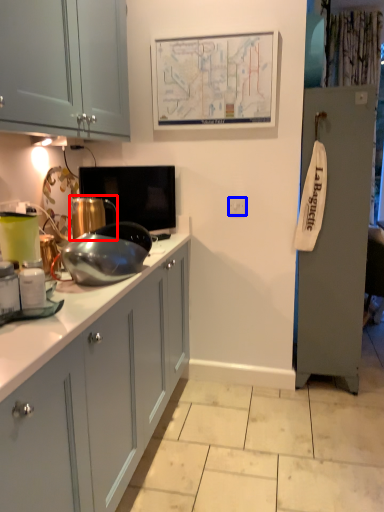
Question: Among these objects, which one is farthest to the camera, appliance (highlighted by a red box) or electric outlet (highlighted by a blue box)?

Choices:
 (A) appliance
 (B) electric outlet

Answer: (B)